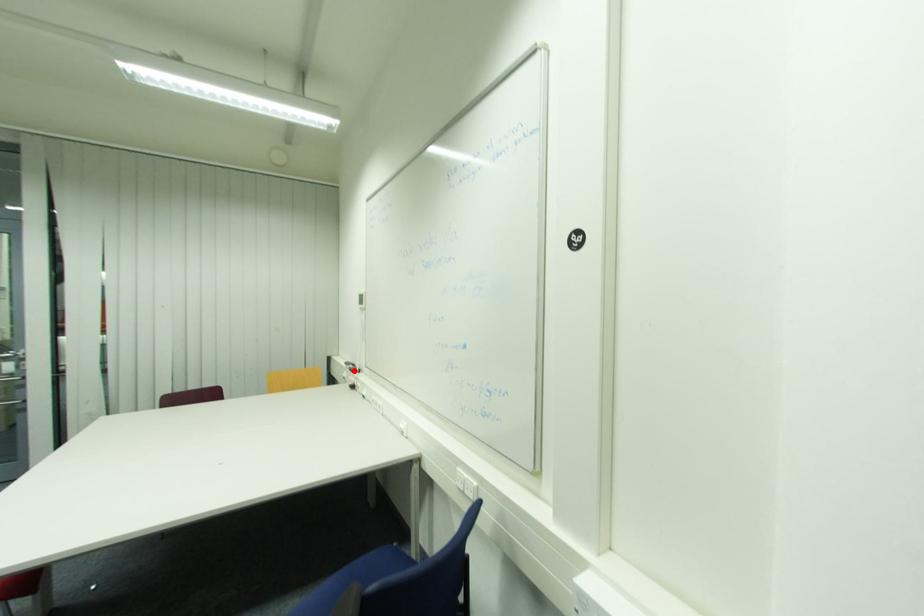
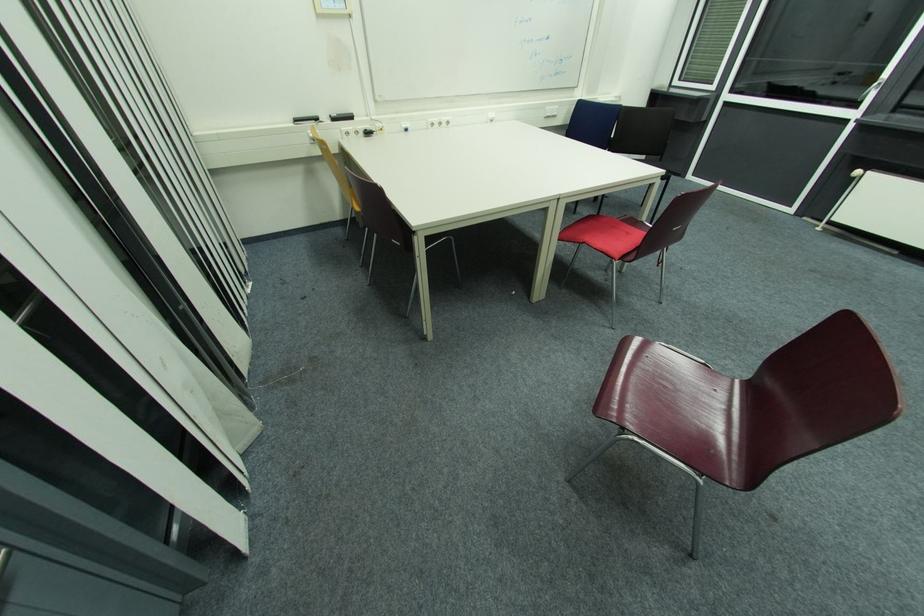
Question: I am providing you with two images of the same scene from different viewpoints. In image1, a red point is highlighted. Considering the same 3D point in image2, which of the following is correct?

Choices:
 (A) It is closer
 (B) It is farther

Answer: (A)